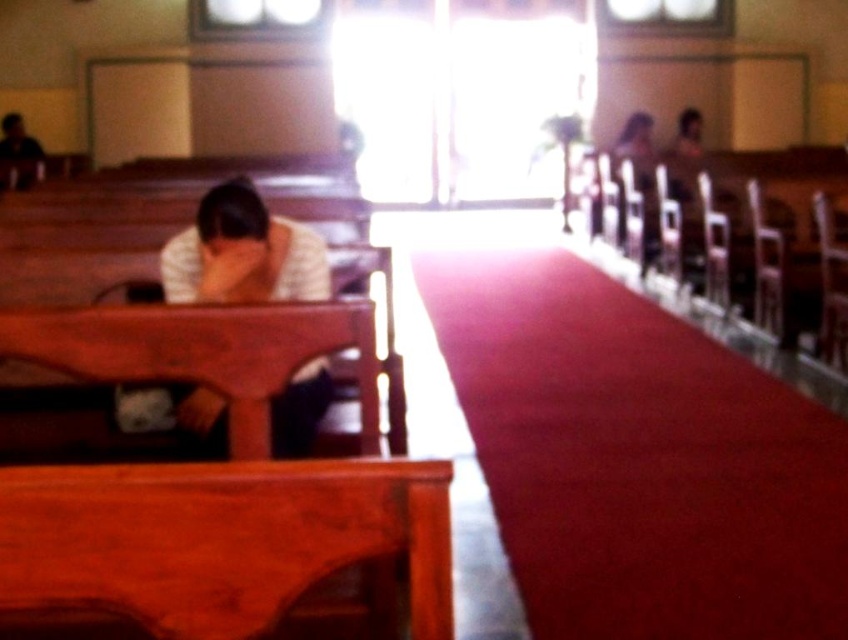
Is point (523, 525) positioned behind point (293, 435)?

Yes, it is behind point (293, 435).

Based on the photo, who is shorter, velvet red carpet at center or white matte shirt at left?

With less height is white matte shirt at left.

Is point (662, 353) behind point (174, 289)?

Yes, point (662, 353) is farther from viewer.

I want to click on velvet red carpet at center, so click(x=639, y=458).